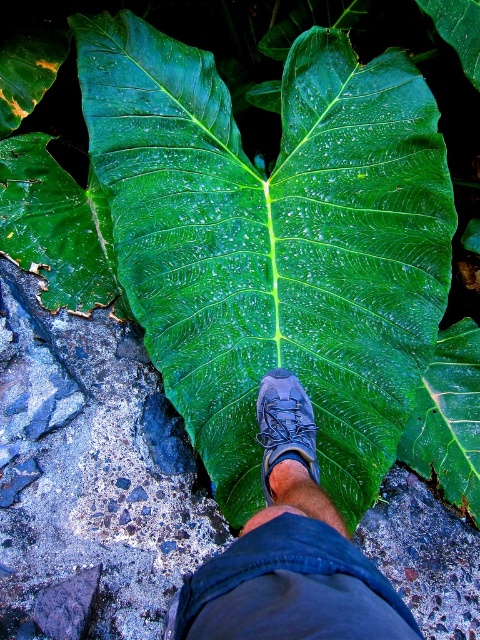
You are standing in a forest and see the dark gray leather shoe at center and the matte blue shoe at center. Which shoe is closer to the ground?

The dark gray leather shoe at center is closer to the ground because it is positioned under the matte blue shoe at center.

Consider the image. You are standing in a forest and see the green glossy leaf at center and the dark gray leather shoe at center. Which object is positioned more to the right from your perspective?

The green glossy leaf at center is positioned to the right of the dark gray leather shoe at center.

You are a botanist examining the green glossy leaf at center and the dark gray leather shoe at center in the image. Which object takes up more space in the image?

The green glossy leaf at center takes up more space in the image because it has a larger size compared to the dark gray leather shoe at center.